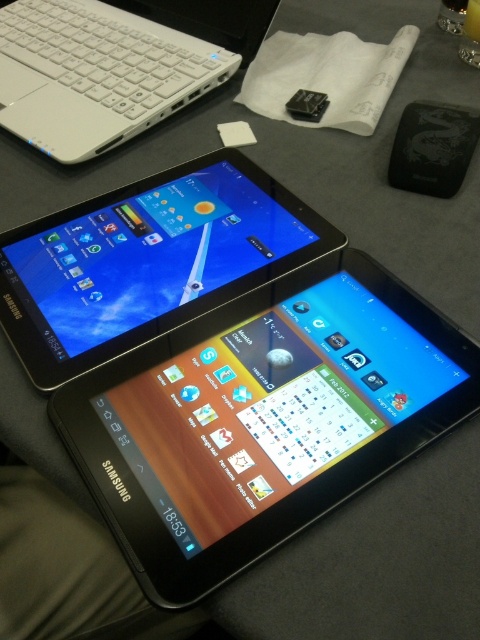
You are trying to place both the white plastic laptop at upper left and the black matte ipod at upper right into a rectangular box that can only fit items up to 12 inches in width. Based on their widths, can both items fit side by side without overlapping?

The white plastic laptop at upper left might be wider than the black matte ipod at upper right, so there is uncertainty whether both can fit side by side in the box. Measure their actual widths to confirm.

You are trying to locate the black glossy tablet at upper center on the table. According to the coordinates provided, what are its exact coordinates?

The black glossy tablet at upper center is located at point (147, 260).